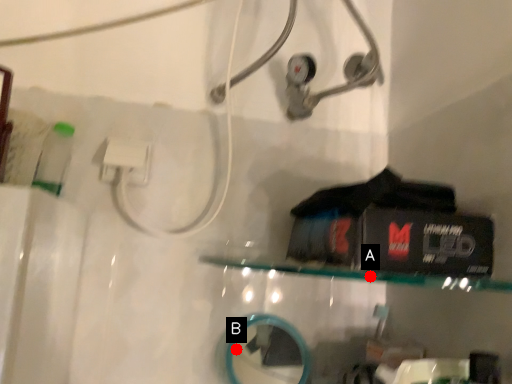
Question: Two points are circled on the image, labeled by A and B beside each circle. Which point is closer to the camera?

Choices:
 (A) A is closer
 (B) B is closer

Answer: (A)